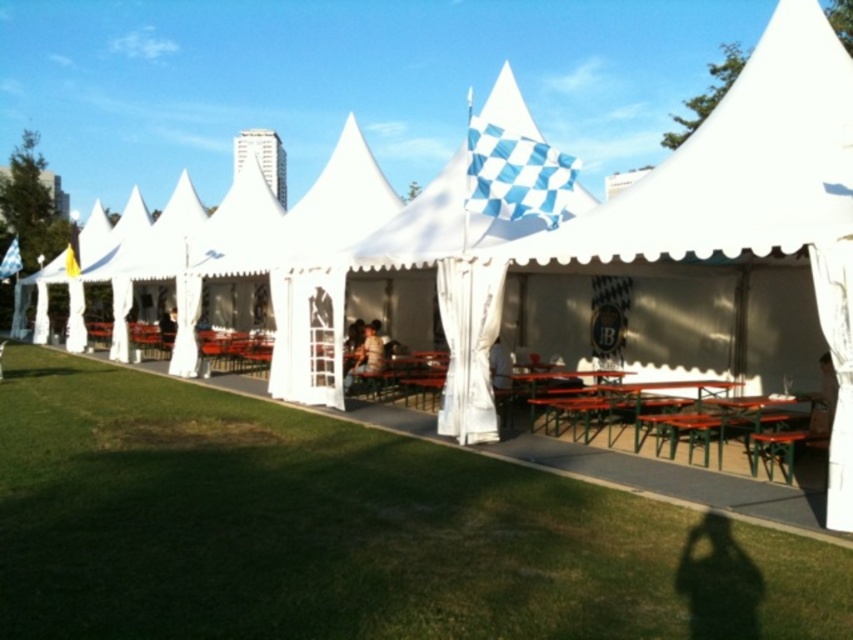
Does green grass at lower left have a lesser width compared to wooden picnic table at center?

No.

Measure the distance between green grass at lower left and camera.

green grass at lower left and camera are 11.94 feet apart from each other.

The width and height of the screenshot is (853, 640). What are the coordinates of `green grass at lower left` in the screenshot? It's located at (347, 531).

Find the location of a particular element. The height and width of the screenshot is (640, 853). green grass at lower left is located at coordinates (347, 531).

Who is positioned more to the right, green grass at lower left or green metal table at center?

green metal table at center is more to the right.

Describe the element at coordinates (347, 531) in the screenshot. This screenshot has width=853, height=640. I see `green grass at lower left` at that location.

Where is `green grass at lower left`? green grass at lower left is located at coordinates (347, 531).

Which is more to the right, wooden picnic table at center or green metal table at center?

green metal table at center is more to the right.

Where is `wooden picnic table at center`? This screenshot has height=640, width=853. wooden picnic table at center is located at coordinates (674, 419).